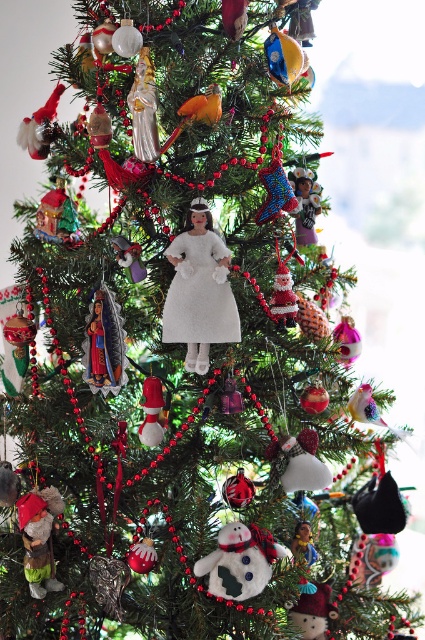
Between white matte doll at center and satin santa at center, which one is positioned higher?

Answer: white matte doll at center

Is white matte doll at center smaller than satin santa at center?

No, white matte doll at center is not smaller than satin santa at center.

Is point (197, 339) less distant than point (153, 406)?

Yes, it is.

Identify the location of white matte doll at center. [x=200, y=289].

Is shiny metallic angel at center above satin santa at center?

Correct, shiny metallic angel at center is located above satin santa at center.

The image size is (425, 640). In order to click on shiny metallic angel at center in this screenshot , I will do `click(305, 204)`.

Can you confirm if fuzzy white snowman at center is positioned above satin santa at center?

No, fuzzy white snowman at center is not above satin santa at center.

Is fuzzy white snowman at center further to the viewer compared to satin santa at center?

No.

Is point (229, 536) positioned in front of point (149, 440)?

Yes.

Where is `fuzzy white snowman at center`? Image resolution: width=425 pixels, height=640 pixels. fuzzy white snowman at center is located at coordinates (240, 561).